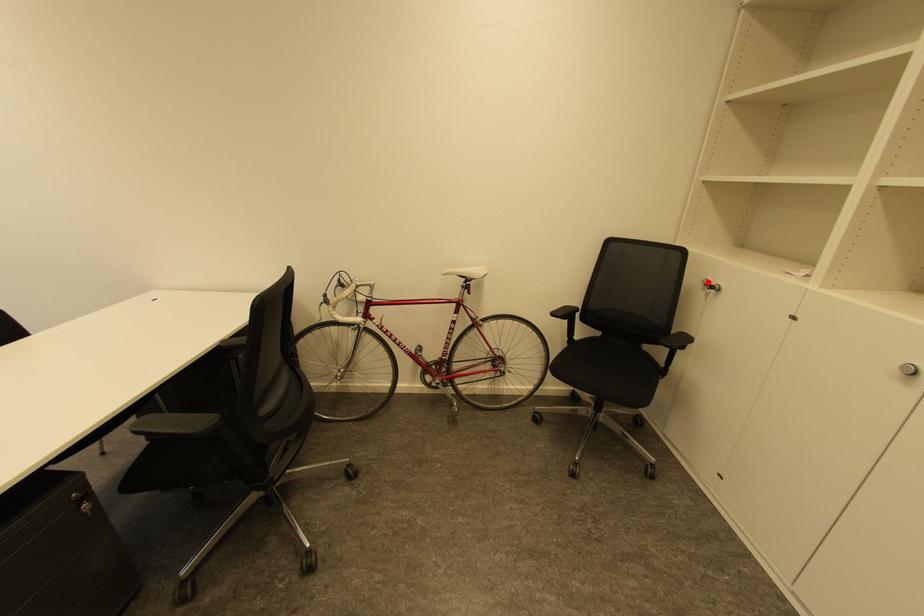
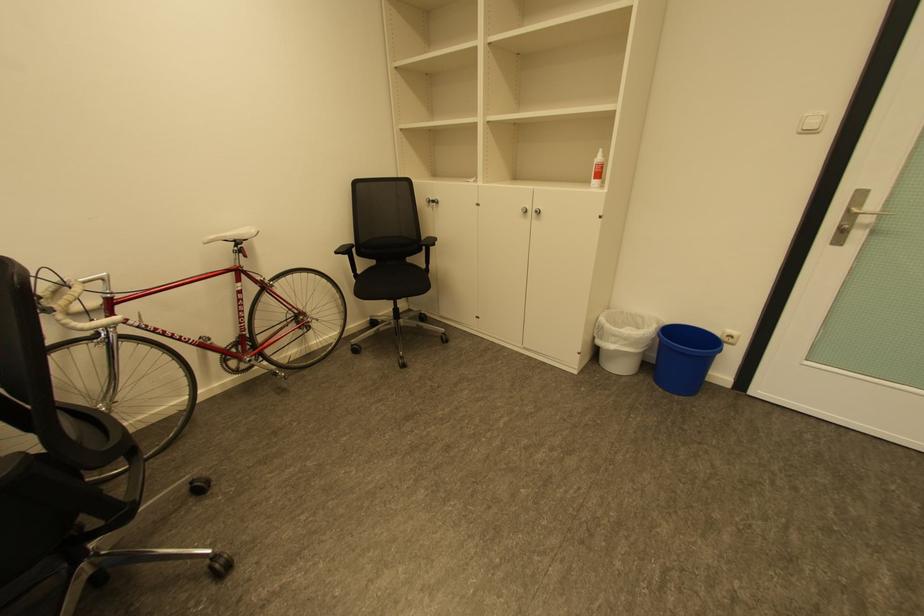
In the second image, find the point that corresponds to the highlighted location in the first image.

(432, 201)